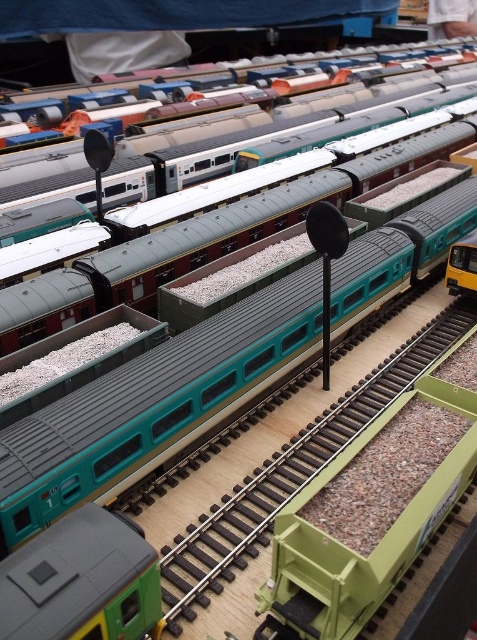
You are setting up a model railway and need to place a new green rubber train track at center. According to the provided coordinates, where should you position it relative to the existing green and teal passenger train?

The green rubber train track at center is located at point (291,474), so you should position it at those coordinates relative to the existing green and teal passenger train.

You are a model train enthusiast who wants to place a new train on the green rubber train track at center. You are currently standing 20 feet away from the track. Can you reach the track without moving closer?

The green rubber train track at center is 22.90 feet away from the viewer. Since you are 20 feet away, you need to move 2.9 feet closer to reach it.